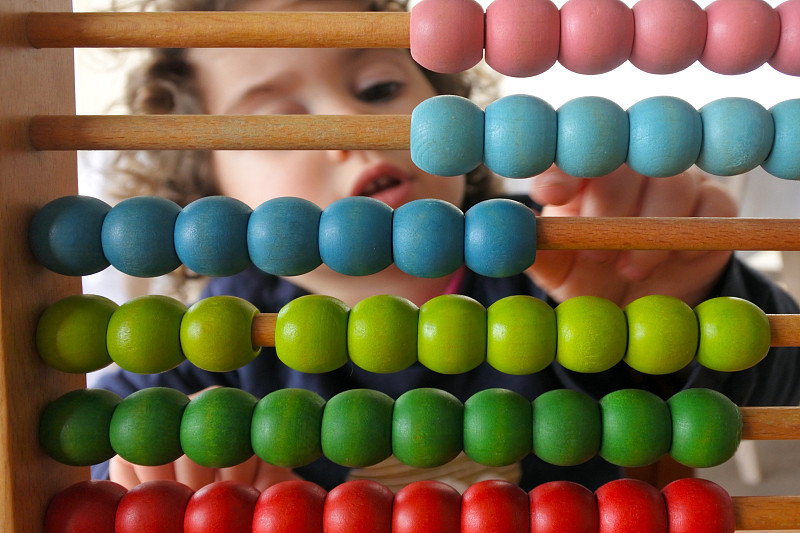
At what (x,y) coordinates should I click in order to perform the action: click on pink bead. Please return your answer as a coordinate pair (x, y). Looking at the image, I should click on (446, 37), (506, 47), (593, 51), (681, 42), (726, 35), (790, 35).